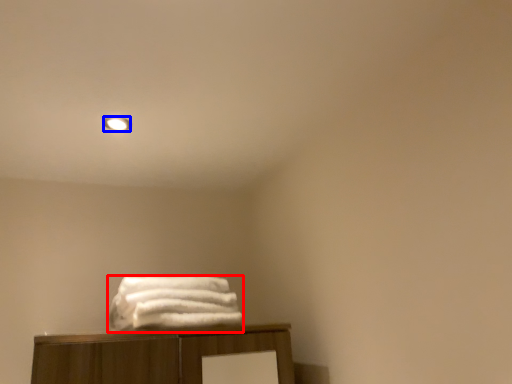
Question: Which object is closer to the camera taking this photo, towel (highlighted by a red box) or lighting (highlighted by a blue box)?

Choices:
 (A) towel
 (B) lighting

Answer: (A)